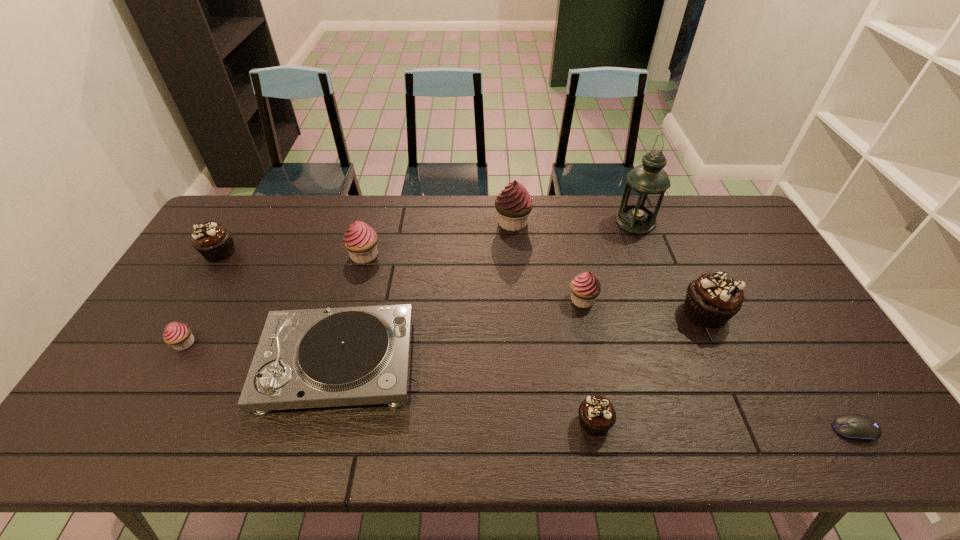
Identify the location of cupcake positioned at the far edge. This screenshot has height=540, width=960. (514, 204).

I want to click on record player that is at the near edge, so point(311,358).

Where is `cupcake that is positioned at the near edge`? cupcake that is positioned at the near edge is located at coordinates (596, 413).

The height and width of the screenshot is (540, 960). I want to click on computer mouse that is positioned at the near edge, so click(852, 426).

You are a GUI agent. You are given a task and a screenshot of the screen. Output one action in this format:
    pyautogui.click(x=<x>, y=<y>)
    Task: Click on the object located in the right edge section of the desktop
    The height and width of the screenshot is (540, 960).
    Given the screenshot: What is the action you would take?
    pyautogui.click(x=852, y=426)

Identify the location of object that is positioned at the near right corner. The height and width of the screenshot is (540, 960). (852, 426).

The width and height of the screenshot is (960, 540). In the image, there is a desktop. In order to click on blank space at the far edge in this screenshot , I will do `click(541, 225)`.

In the image, there is a desktop. Where is `blank space at the near edge`? Image resolution: width=960 pixels, height=540 pixels. blank space at the near edge is located at coordinates (318, 419).

Where is `vacant space at the left edge of the desktop`? The image size is (960, 540). vacant space at the left edge of the desktop is located at coordinates (194, 255).

In the image, there is a desktop. In order to click on vacant space at the near left corner in this screenshot , I will do `click(124, 422)`.